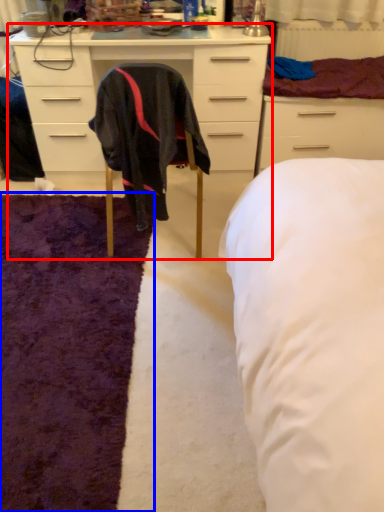
Question: Among these objects, which one is nearest to the camera, cabinetry (highlighted by a red box) or mat (highlighted by a blue box)?

Choices:
 (A) cabinetry
 (B) mat

Answer: (B)